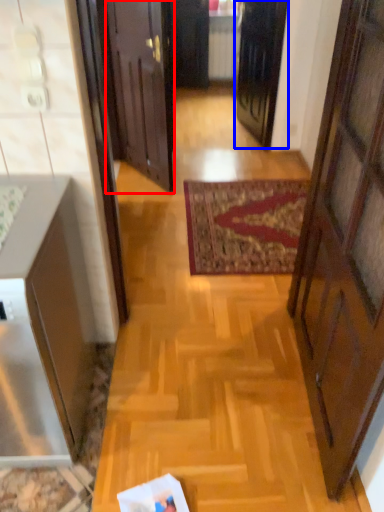
Question: Which of the following is the closest to the observer, door (highlighted by a red box) or door (highlighted by a blue box)?

Choices:
 (A) door
 (B) door

Answer: (A)